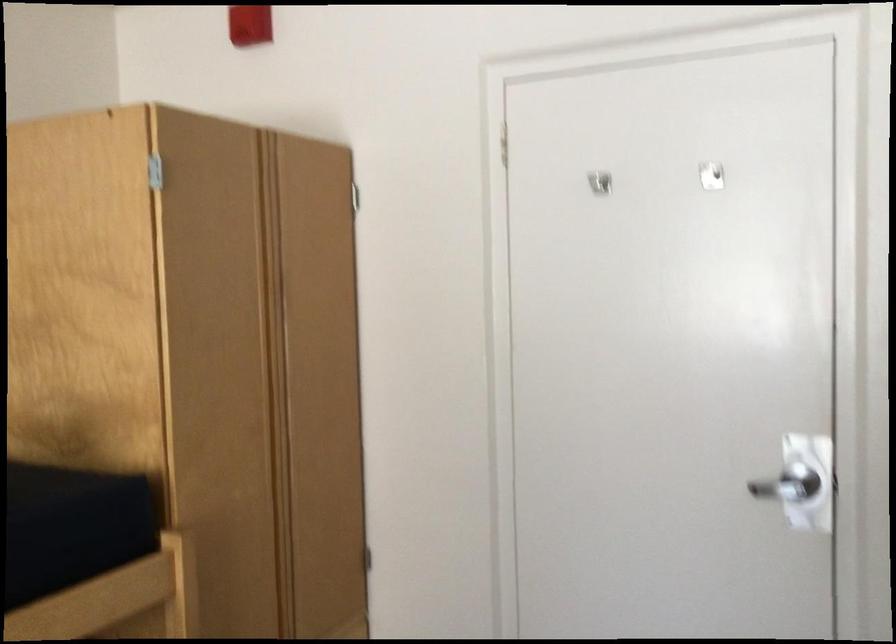
What do you see at coordinates (788, 484) in the screenshot?
I see `the silver door handle` at bounding box center [788, 484].